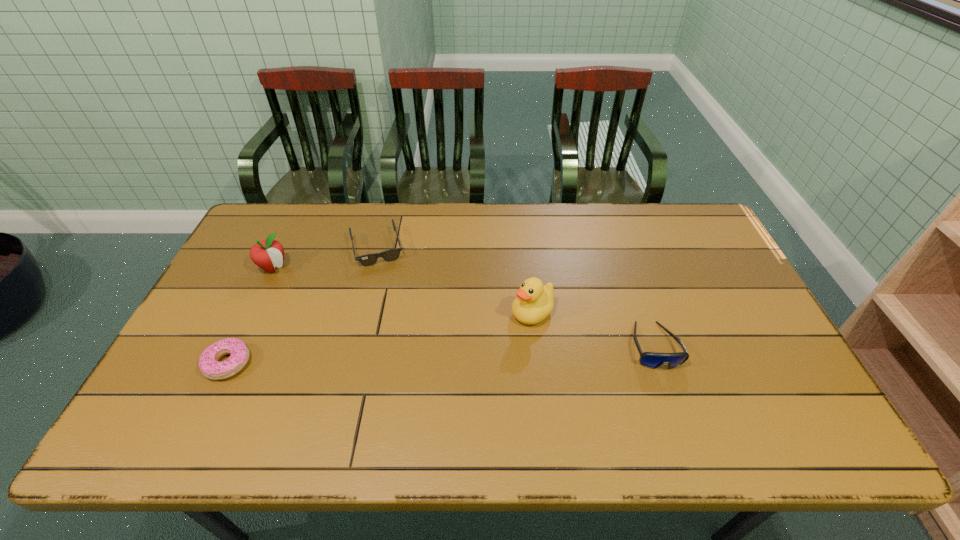
This screenshot has height=540, width=960. Find the location of `free space that satisfies the following two spatial constraints: 1. on the back side of the doughnut; 2. on the right side of the fourth object from left to right`. free space that satisfies the following two spatial constraints: 1. on the back side of the doughnut; 2. on the right side of the fourth object from left to right is located at coordinates (252, 313).